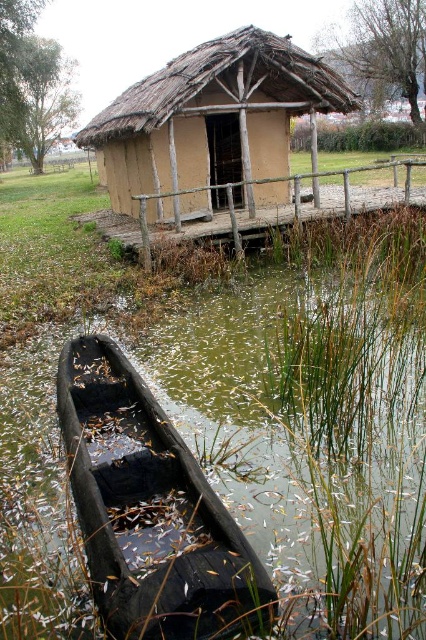
Question: Can you confirm if green mossy water at bottom left is positioned to the right of brown clay hut at center?

Choices:
 (A) no
 (B) yes

Answer: (B)

Question: Is dark brown wooden boat at lower left positioned before brown clay hut at center?

Choices:
 (A) no
 (B) yes

Answer: (B)

Question: Which object appears farthest from the camera in this image?

Choices:
 (A) green mossy water at bottom left
 (B) brown clay hut at center

Answer: (B)

Question: Estimate the real-world distances between objects in this image. Which object is closer to the green mossy water at bottom left?

Choices:
 (A) dark brown wooden boat at lower left
 (B) brown clay hut at center

Answer: (A)

Question: Observing the image, what is the correct spatial positioning of dark brown wooden boat at lower left in reference to brown clay hut at center?

Choices:
 (A) right
 (B) left

Answer: (A)

Question: Which of these objects is positioned farthest from the brown clay hut at center?

Choices:
 (A) green mossy water at bottom left
 (B) dark brown wooden boat at lower left

Answer: (A)